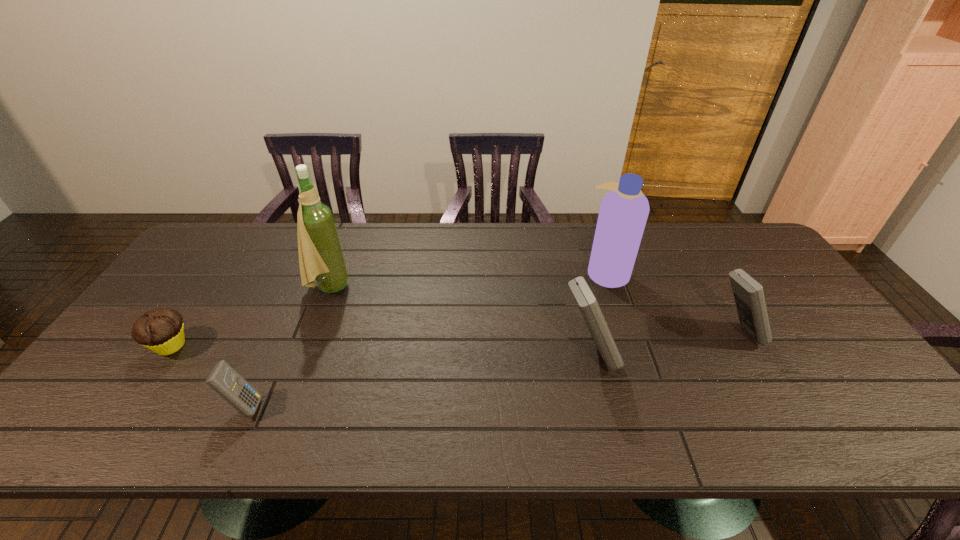
This screenshot has width=960, height=540. I want to click on free space located 0.350m on the front-facing side of the second calculator from left to right, so click(754, 356).

This screenshot has width=960, height=540. Identify the location of free location located on the front-facing side of the fourth tallest object. [826, 334].

This screenshot has width=960, height=540. I want to click on blank space located 0.270m on the front-facing side of the wine bottle, so click(x=441, y=287).

At what (x,y) coordinates should I click in order to perform the action: click on vacant space situated 0.190m on the right of the muffin. Please return your answer as a coordinate pair (x, y). Looking at the image, I should click on (264, 346).

At what (x,y) coordinates should I click in order to perform the action: click on free space located on the back of the shampoo. Please return your answer as a coordinate pair (x, y). Image resolution: width=960 pixels, height=540 pixels. Looking at the image, I should click on (597, 244).

Where is `object that is positioned at the far edge`? The image size is (960, 540). object that is positioned at the far edge is located at coordinates (624, 210).

The height and width of the screenshot is (540, 960). In order to click on object that is at the left edge in this screenshot , I will do `click(161, 330)`.

Locate an element on the screen. The image size is (960, 540). vacant region at the far edge of the desktop is located at coordinates (406, 245).

Where is `free region at the near edge of the desktop`? free region at the near edge of the desktop is located at coordinates (450, 386).

The height and width of the screenshot is (540, 960). What are the coordinates of `free region at the far right corner` in the screenshot? It's located at (728, 251).